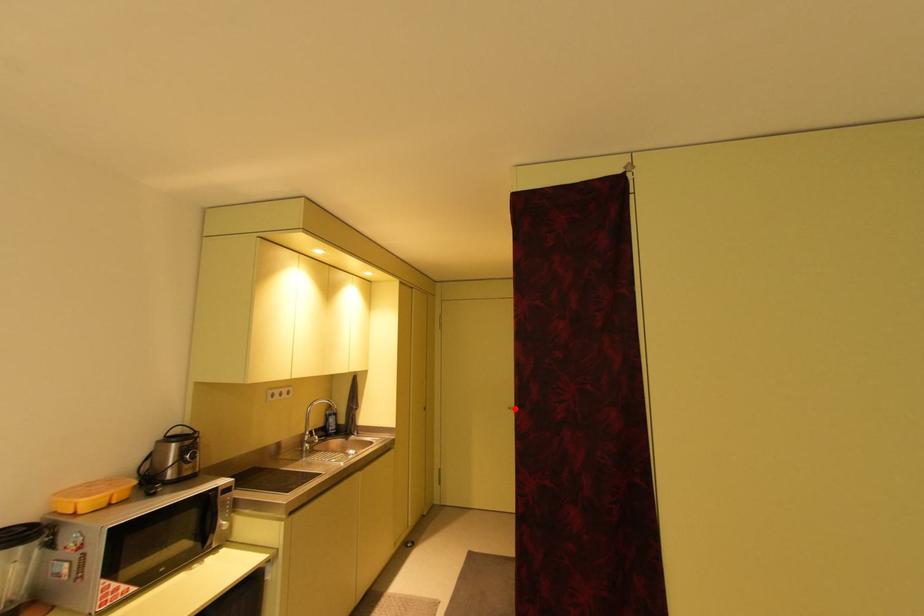
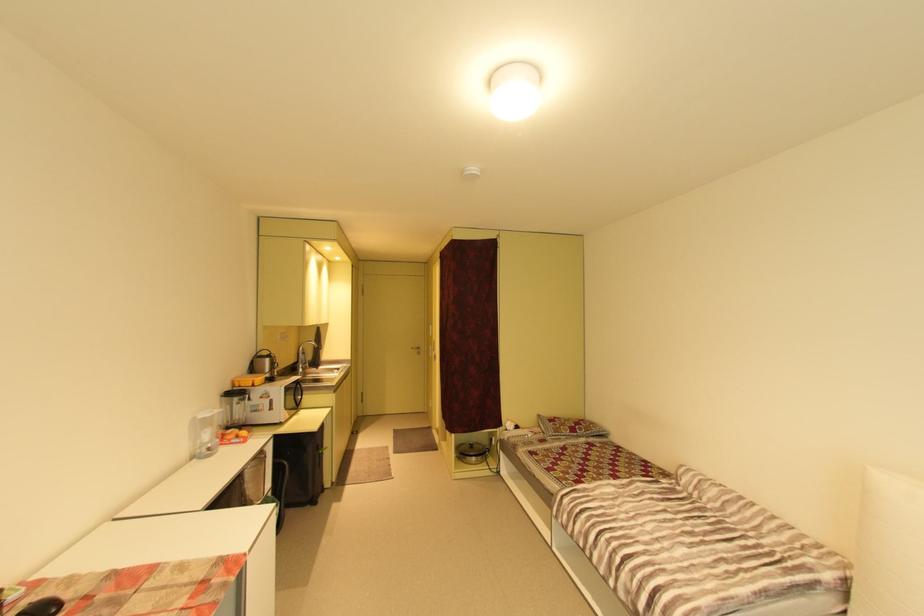
The point at the highlighted location is marked in the first image. Where is the corresponding point in the second image?

(419, 349)